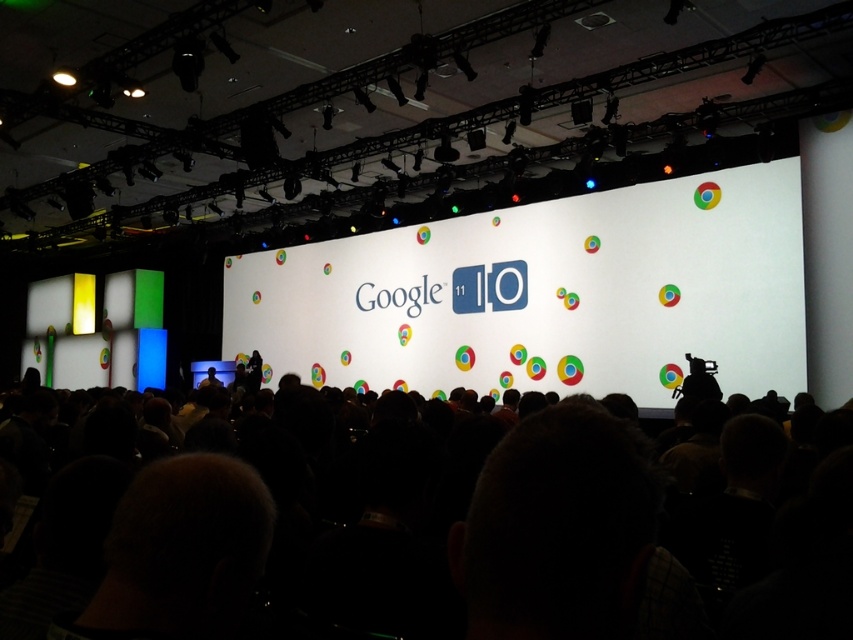
You are an attendee at the Google I.O. 2011 event and you see the white paper at center. Where is the white paper located in the image?

The white paper at center is located at the coordinates point (544, 294) in the image.

You are an attendee at the Google I O 2011 event and you see a point marked at coordinates (544, 294) in the image. According to the scene description, where is this point located?

The point (544, 294) is located on the white paper at center.